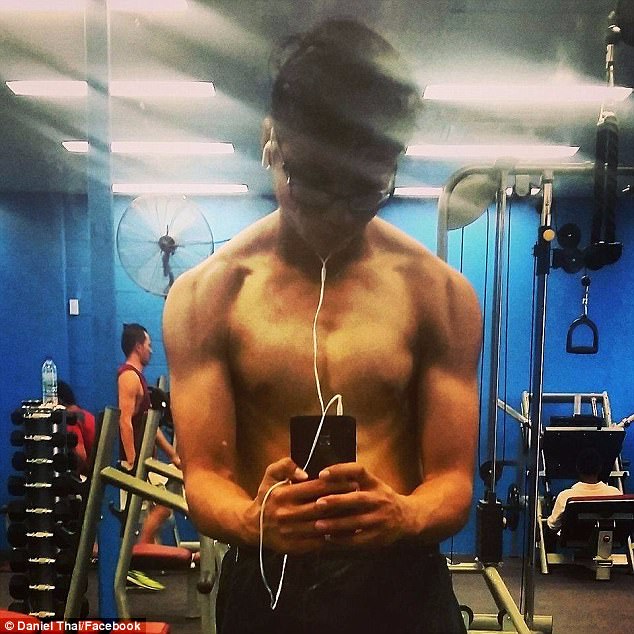
Identify the location of setting is a gym. (496, 358).